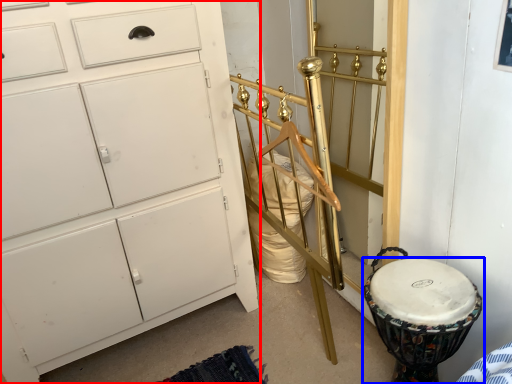
Question: Which point is closer to the camera, chest of drawers (highlighted by a red box) or drum (highlighted by a blue box)?

Choices:
 (A) chest of drawers
 (B) drum

Answer: (A)